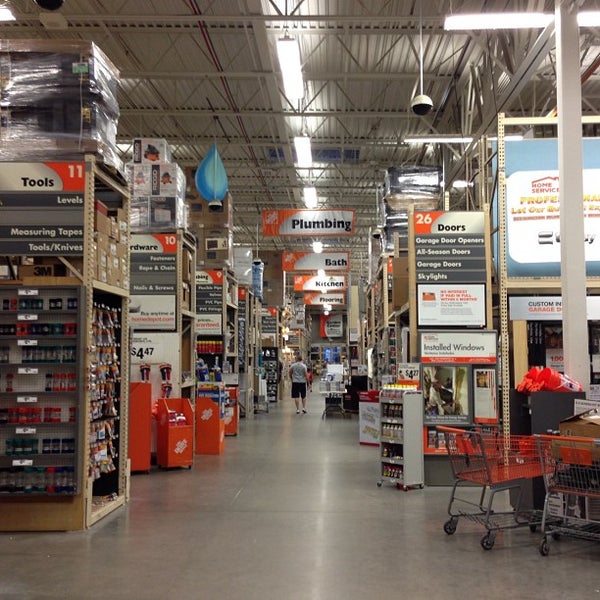
The image size is (600, 600). Find the location of `handle`. handle is located at coordinates (446, 426), (580, 437).